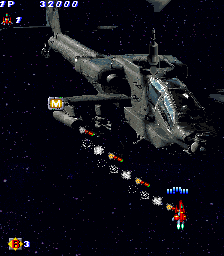
Locate an element on the screen. The image size is (224, 256). box is located at coordinates (19, 240).